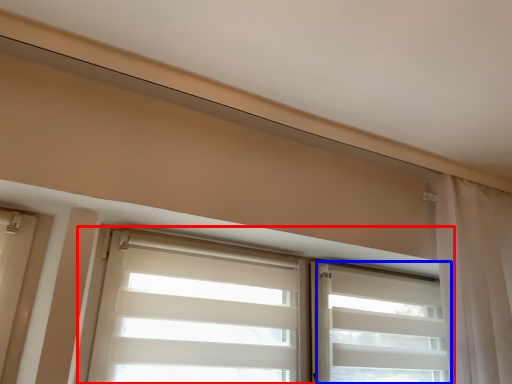
Question: Among these objects, which one is farthest to the camera, window (highlighted by a red box) or shutter (highlighted by a blue box)?

Choices:
 (A) window
 (B) shutter

Answer: (B)